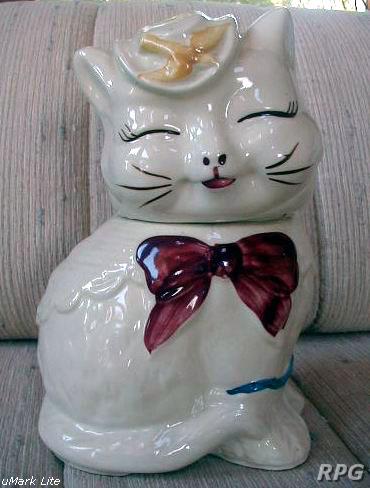
What are the coordinates of `glass` in the screenshot? It's located at (92, 345).